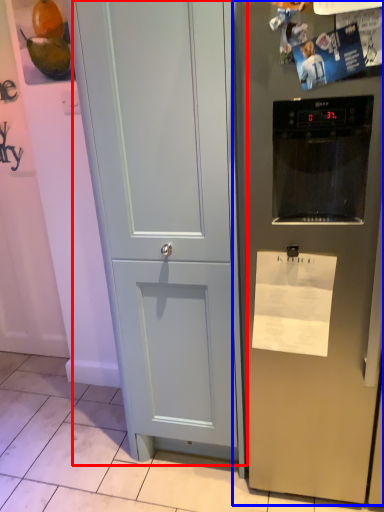
Question: Among these objects, which one is nearest to the camera, door (highlighted by a red box) or refrigerator (highlighted by a blue box)?

Choices:
 (A) door
 (B) refrigerator

Answer: (B)